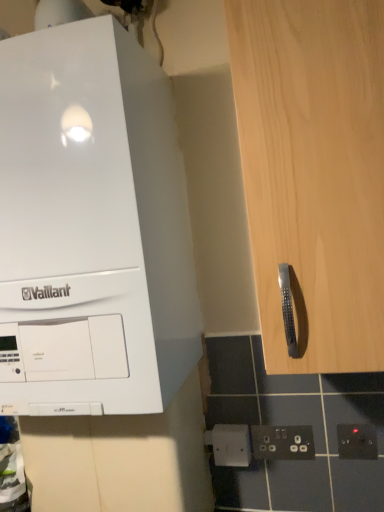
Question: Does white plastic electric outlet at lower center, which ranks as the 1th electric outlet in left-to-right order, have a greater height compared to light wood cabinet handle at right?

Choices:
 (A) yes
 (B) no

Answer: (B)

Question: Considering the relative sizes of white plastic electric outlet at lower center, which ranks as the 1th electric outlet in left-to-right order, and light wood cabinet handle at right in the image provided, is white plastic electric outlet at lower center, which ranks as the 1th electric outlet in left-to-right order, shorter than light wood cabinet handle at right?

Choices:
 (A) no
 (B) yes

Answer: (B)

Question: Can you confirm if white plastic electric outlet at lower center, which ranks as the 1th electric outlet in left-to-right order, is positioned to the left of light wood cabinet handle at right?

Choices:
 (A) yes
 (B) no

Answer: (A)

Question: Is white plastic electric outlet at lower center, positioned as the third electric outlet in right-to-left order, positioned behind light wood cabinet handle at right?

Choices:
 (A) no
 (B) yes

Answer: (B)

Question: Is white plastic electric outlet at lower center, which ranks as the 1th electric outlet in left-to-right order, not within light wood cabinet handle at right?

Choices:
 (A) no
 (B) yes

Answer: (B)

Question: Is white plastic electric outlet at lower center, positioned as the third electric outlet in right-to-left order, smaller than light wood cabinet handle at right?

Choices:
 (A) yes
 (B) no

Answer: (A)

Question: Considering the relative positions of light wood cabinet handle at right and black plastic electric outlet at lower right, which is the first electric outlet from right to left, in the image provided, is light wood cabinet handle at right to the left of black plastic electric outlet at lower right, which is the first electric outlet from right to left, from the viewer's perspective?

Choices:
 (A) yes
 (B) no

Answer: (A)

Question: Considering the relative sizes of light wood cabinet handle at right and black plastic electric outlet at lower right, which ranks as the third electric outlet in left-to-right order, in the image provided, is light wood cabinet handle at right smaller than black plastic electric outlet at lower right, which ranks as the third electric outlet in left-to-right order,?

Choices:
 (A) no
 (B) yes

Answer: (A)

Question: Is light wood cabinet handle at right far away from black plastic electric outlet at lower right, which is the first electric outlet from right to left?

Choices:
 (A) yes
 (B) no

Answer: (B)

Question: From a real-world perspective, does light wood cabinet handle at right sit lower than black plastic electric outlet at lower right, which ranks as the third electric outlet in left-to-right order?

Choices:
 (A) yes
 (B) no

Answer: (B)

Question: Does light wood cabinet handle at right come behind black plastic electric outlet at lower right, which is the first electric outlet from right to left?

Choices:
 (A) yes
 (B) no

Answer: (B)

Question: Is light wood cabinet handle at right positioned beyond the bounds of black plastic electric outlet at lower right, which is the first electric outlet from right to left?

Choices:
 (A) no
 (B) yes

Answer: (B)

Question: Are light wood cabinet handle at right and white plastic socket at lower center, marked as the second electric outlet in a right-to-left arrangement, making contact?

Choices:
 (A) yes
 (B) no

Answer: (B)